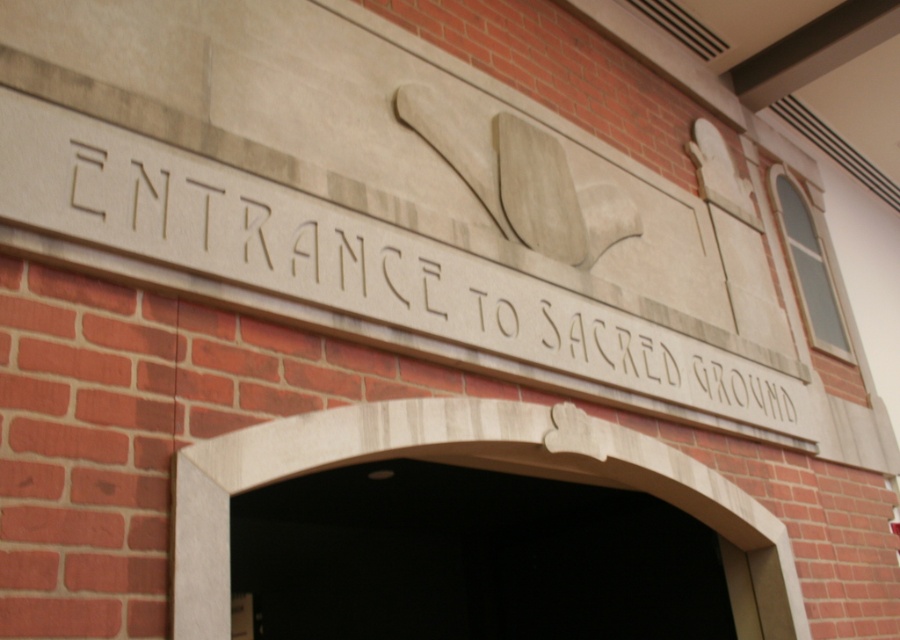
Does carved stone sign at center appear on the left side of smooth stone arch at center?

In fact, carved stone sign at center is to the right of smooth stone arch at center.

Which is more to the right, carved stone sign at center or smooth stone arch at center?

Positioned to the right is carved stone sign at center.

Is point (132, 218) positioned after point (225, 609)?

Yes, it is.

Locate an element on the screen. The width and height of the screenshot is (900, 640). carved stone sign at center is located at coordinates (402, 282).